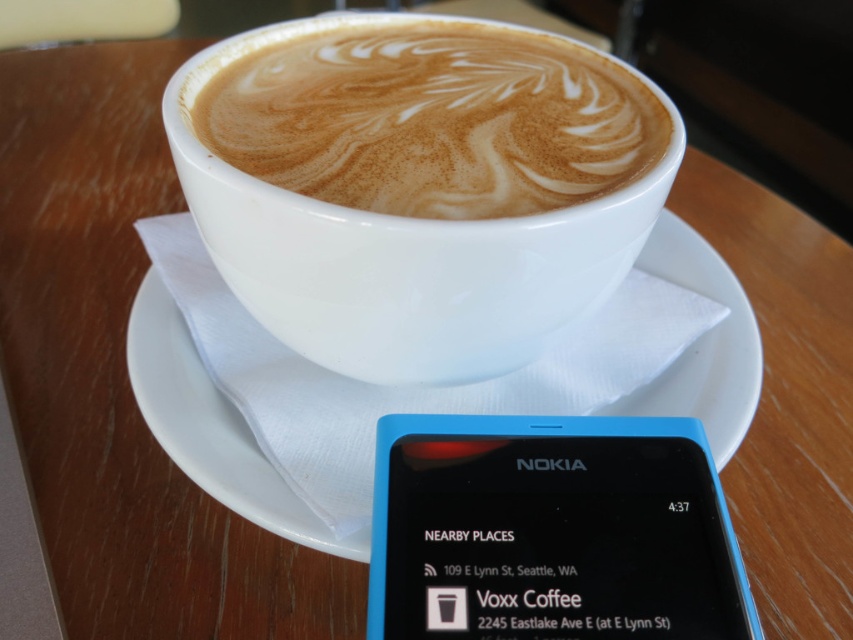
Question: Is blue plastic nokia phone at lower center positioned in front of white matte cup at center?

Choices:
 (A) no
 (B) yes

Answer: (B)

Question: Considering the real-world distances, which object is farthest from the white ceramic saucer at upper center?

Choices:
 (A) blue plastic nokia phone at lower center
 (B) white matte cup at center

Answer: (B)

Question: Is blue plastic nokia phone at lower center below white ceramic saucer at upper center?

Choices:
 (A) no
 (B) yes

Answer: (B)

Question: Which point is closer to the camera?

Choices:
 (A) (503, 429)
 (B) (553, 136)

Answer: (A)

Question: Can you confirm if white matte cup at center is smaller than white ceramic saucer at upper center?

Choices:
 (A) no
 (B) yes

Answer: (A)

Question: Which point is farther from the camera taking this photo?

Choices:
 (A) (495, 488)
 (B) (241, 508)

Answer: (B)